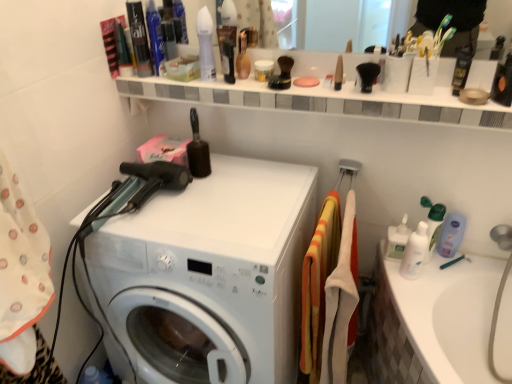
Describe the element at coordinates (322, 101) in the screenshot. Image resolution: width=512 pixels, height=384 pixels. I see `white glossy shelf at upper center` at that location.

Image resolution: width=512 pixels, height=384 pixels. Describe the element at coordinates (341, 300) in the screenshot. I see `white fabric at center, marked as the 1th material in a right-to-left arrangement` at that location.

This screenshot has width=512, height=384. Identify the location of shiny blue bottle at upper left, acting as the 7th toiletry starting from the bottom. (155, 38).

Where is `black matte hair gel at upper right, the 2th toiletry ordered from the bottom`? The width and height of the screenshot is (512, 384). black matte hair gel at upper right, the 2th toiletry ordered from the bottom is located at coordinates (462, 67).

What do you see at coordinates (263, 69) in the screenshot? The width and height of the screenshot is (512, 384). I see `white matte jar at upper center, placed as the 4th toiletry when sorted from bottom to top` at bounding box center [263, 69].

Locate an element on the screen. This screenshot has height=384, width=512. matte beige vase at upper center, which is the third toiletry in left-to-right order is located at coordinates (242, 57).

Which object is more forward, white plastic bottles at right, which is the 1th cleaning product in left-to-right order, or white matte jar at upper center, the 4th toiletry positioned from the left?

Positioned in front is white matte jar at upper center, the 4th toiletry positioned from the left.

Looking at this image, between white plastic bottles at right, positioned as the second cleaning product in right-to-left order, and white matte jar at upper center, placed as the 4th toiletry when sorted from bottom to top, which one has smaller width?

white plastic bottles at right, positioned as the second cleaning product in right-to-left order.

From the image's perspective, is white plastic bottles at right, which is the 1th cleaning product in left-to-right order, on white matte jar at upper center, which ranks as the 4th toiletry in right-to-left order?

No.

Is white plastic bottles at right, which is the 1th cleaning product in left-to-right order, in contact with white matte jar at upper center, which appears as the 4th toiletry when viewed from the top?

white plastic bottles at right, which is the 1th cleaning product in left-to-right order, is not next to white matte jar at upper center, which appears as the 4th toiletry when viewed from the top, and they're not touching.

Where is `the 4th toiletry in front of the shiny blue bottle at upper left, which is the 6th toiletry in right-to-left order, starting your count from the anchor`? the 4th toiletry in front of the shiny blue bottle at upper left, which is the 6th toiletry in right-to-left order, starting your count from the anchor is located at coordinates (462, 67).

Is black matte hair gel at upper right, the seventh toiletry positioned from the left, in front of or behind shiny blue bottle at upper left, the 2th toiletry positioned from the left, in the image?

Visually, black matte hair gel at upper right, the seventh toiletry positioned from the left, is located in front of shiny blue bottle at upper left, the 2th toiletry positioned from the left.

Is black matte hair gel at upper right, positioned as the sixth toiletry in top-to-bottom order, thinner than shiny blue bottle at upper left, marked as the first toiletry in a top-to-bottom arrangement?

Yes, black matte hair gel at upper right, positioned as the sixth toiletry in top-to-bottom order, is thinner than shiny blue bottle at upper left, marked as the first toiletry in a top-to-bottom arrangement.

From the image's perspective, is black matte hair gel at upper right, the seventh toiletry positioned from the left, located above shiny blue bottle at upper left, the 2th toiletry positioned from the left?

No.

Which of these two, orange/yellow striped towel at center, the first material in the left-to-right sequence, or white glossy lotion at right, which is the sixth toiletry from left to right, is smaller?

With smaller size is white glossy lotion at right, which is the sixth toiletry from left to right.

Can white glossy lotion at right, which ranks as the 7th toiletry in top-to-bottom order, be found inside orange/yellow striped towel at center, the second material viewed from the right?

No.

From a real-world perspective, is orange/yellow striped towel at center, the second material viewed from the right, below white glossy lotion at right, marked as the second toiletry in a right-to-left arrangement?

Yes, from a real-world perspective, orange/yellow striped towel at center, the second material viewed from the right, is under white glossy lotion at right, marked as the second toiletry in a right-to-left arrangement.

From the image's perspective, is orange/yellow striped towel at center, the first material in the left-to-right sequence, located above white glossy lotion at right, marked as the second toiletry in a right-to-left arrangement?

No, from the image's perspective, orange/yellow striped towel at center, the first material in the left-to-right sequence, is not on top of white glossy lotion at right, marked as the second toiletry in a right-to-left arrangement.

Is white fabric at center, which is the 2th material in left-to-right order, facing towards white glossy lotion at right, which ranks as the 7th toiletry in top-to-bottom order?

Yes.

Based on their sizes in the image, would you say white fabric at center, marked as the 1th material in a right-to-left arrangement, is bigger or smaller than white glossy lotion at right, which is the sixth toiletry from left to right?

In the image, white fabric at center, marked as the 1th material in a right-to-left arrangement, appears to be larger than white glossy lotion at right, which is the sixth toiletry from left to right.

Is white fabric at center, which is the 2th material in left-to-right order, completely or partially outside of white glossy lotion at right, which ranks as the 7th toiletry in top-to-bottom order?

Yes, white fabric at center, which is the 2th material in left-to-right order, is not within white glossy lotion at right, which ranks as the 7th toiletry in top-to-bottom order.

Is white fabric at center, which is the 2th material in left-to-right order, thinner than white glossy lotion at right, which ranks as the 7th toiletry in top-to-bottom order?

Incorrect, the width of white fabric at center, which is the 2th material in left-to-right order, is not less than that of white glossy lotion at right, which ranks as the 7th toiletry in top-to-bottom order.

Is shiny plastic hair spray at upper left, positioned as the seventh toiletry in right-to-left order, bigger or smaller than matte beige vase at upper center, which is the third toiletry in left-to-right order?

In the image, shiny plastic hair spray at upper left, positioned as the seventh toiletry in right-to-left order, appears to be larger than matte beige vase at upper center, which is the third toiletry in left-to-right order.

Does shiny plastic hair spray at upper left, the 1th toiletry viewed from the left, have a greater width compared to matte beige vase at upper center, the 3th toiletry in the top-to-bottom sequence?

Yes, shiny plastic hair spray at upper left, the 1th toiletry viewed from the left, is wider than matte beige vase at upper center, the 3th toiletry in the top-to-bottom sequence.

How many degrees apart are the facing directions of shiny plastic hair spray at upper left, the 1th toiletry viewed from the left, and matte beige vase at upper center, which is the 5th toiletry from bottom to top?

The facing directions of shiny plastic hair spray at upper left, the 1th toiletry viewed from the left, and matte beige vase at upper center, which is the 5th toiletry from bottom to top, are 8.19 degrees apart.

In order to click on shelve below the shiny blue bottle at upper left, marked as the first toiletry in a top-to-bottom arrangement (from a real-world perspective) in this screenshot , I will do `click(322, 101)`.

Is shiny blue bottle at upper left, marked as the first toiletry in a top-to-bottom arrangement, shorter than white glossy shelf at upper center?

Incorrect, the height of shiny blue bottle at upper left, marked as the first toiletry in a top-to-bottom arrangement, does not fall short of that of white glossy shelf at upper center.

Is shiny blue bottle at upper left, the 2th toiletry positioned from the left, not close to white glossy shelf at upper center?

No, shiny blue bottle at upper left, the 2th toiletry positioned from the left, is not far away from white glossy shelf at upper center.

From a real-world perspective, is white glossy lotion at right, marked as the second toiletry in a right-to-left arrangement, located beneath matte beige vase at upper center, which is the third toiletry in left-to-right order?

Correct, in the physical world, white glossy lotion at right, marked as the second toiletry in a right-to-left arrangement, is lower than matte beige vase at upper center, which is the third toiletry in left-to-right order.

What's the angular difference between white glossy lotion at right, which ranks as the first toiletry in bottom-to-top order, and matte beige vase at upper center, which is the third toiletry in left-to-right order,'s facing directions?

The facing directions of white glossy lotion at right, which ranks as the first toiletry in bottom-to-top order, and matte beige vase at upper center, which is the third toiletry in left-to-right order, are 3 degrees apart.

Is white glossy lotion at right, which is the sixth toiletry from left to right, oriented towards matte beige vase at upper center, the 5th toiletry when ordered from right to left?

No, white glossy lotion at right, which is the sixth toiletry from left to right, is not turned towards matte beige vase at upper center, the 5th toiletry when ordered from right to left.

Are white glossy lotion at right, marked as the second toiletry in a right-to-left arrangement, and matte beige vase at upper center, the 5th toiletry when ordered from right to left, making contact?

No, white glossy lotion at right, marked as the second toiletry in a right-to-left arrangement, is not next to matte beige vase at upper center, the 5th toiletry when ordered from right to left.

There is a white plastic bottles at right, positioned as the second cleaning product in right-to-left order. At what (x,y) coordinates should I click in order to perform the action: click on the 2nd toiletry above it (from a real-world perspective). Please return your answer as a coordinate pair (x, y). Looking at the image, I should click on (263, 69).

At what (x,y) coordinates should I click in order to perform the action: click on toiletry that is the 4th object located in front of the shiny blue bottle at upper left, the 2th toiletry positioned from the left. Please return your answer as a coordinate pair (x, y). The width and height of the screenshot is (512, 384). Looking at the image, I should click on (462, 67).

Looking at the image, which one is located further to black matte hair gel at upper right, positioned as the 1th toiletry in right-to-left order, white matte jar at upper center, placed as the 4th toiletry when sorted from bottom to top, or matte beige vase at upper center, which is the 5th toiletry from bottom to top?

Among the two, white matte jar at upper center, placed as the 4th toiletry when sorted from bottom to top, is located further to black matte hair gel at upper right, positioned as the 1th toiletry in right-to-left order.

Based on their spatial positions, is white plastic bottles at right, positioned as the second cleaning product in right-to-left order, or white glossy lotion at right, marked as the second toiletry in a right-to-left arrangement, closer to white matte jar at upper center, which appears as the 4th toiletry when viewed from the top?

Based on the image, white plastic bottles at right, positioned as the second cleaning product in right-to-left order, appears to be nearer to white matte jar at upper center, which appears as the 4th toiletry when viewed from the top.

Which object lies further to the anchor point white plastic washing machine at center, white glossy lotion at right, which ranks as the first toiletry in bottom-to-top order, or white fabric at center, which is the 2th material in left-to-right order?

white glossy lotion at right, which ranks as the first toiletry in bottom-to-top order.

Looking at the image, which one is located closer to white matte jar at upper center, which ranks as the 4th toiletry in right-to-left order, shiny plastic hair spray at upper left, acting as the 6th toiletry starting from the bottom, or clear plastic bottle at right, placed as the second cleaning product when sorted from left to right?

shiny plastic hair spray at upper left, acting as the 6th toiletry starting from the bottom, lies closer to white matte jar at upper center, which ranks as the 4th toiletry in right-to-left order, than the other object.

Estimate the real-world distances between objects in this image. Which object is further from white plastic washing machine at center, clear plastic bottle at right, placed as the second cleaning product when sorted from left to right, or white plastic bottles at right, positioned as the second cleaning product in right-to-left order?

clear plastic bottle at right, placed as the second cleaning product when sorted from left to right.

Estimate the real-world distances between objects in this image. Which object is closer to orange/yellow striped towel at center, the first material in the left-to-right sequence, shiny plastic hair spray at upper left, acting as the 6th toiletry starting from the bottom, or black matte hair gel at upper right, the seventh toiletry positioned from the left?

Based on the image, shiny plastic hair spray at upper left, acting as the 6th toiletry starting from the bottom, appears to be nearer to orange/yellow striped towel at center, the first material in the left-to-right sequence.

Considering their positions, is white glossy lotion at right, which is the sixth toiletry from left to right, positioned further to shiny plastic hair spray at upper left, acting as the 6th toiletry starting from the bottom, than white matte jar at upper center, the 4th toiletry positioned from the left?

white glossy lotion at right, which is the sixth toiletry from left to right, is positioned further to the anchor shiny plastic hair spray at upper left, acting as the 6th toiletry starting from the bottom.

Based on their spatial positions, is black matte hair gel at upper right, positioned as the 1th toiletry in right-to-left order, or white matte jar at upper center, which appears as the 4th toiletry when viewed from the top, closer to white plastic washing machine at center?

white matte jar at upper center, which appears as the 4th toiletry when viewed from the top, lies closer to white plastic washing machine at center than the other object.

Image resolution: width=512 pixels, height=384 pixels. I want to click on material between orange/yellow striped towel at center, the second material viewed from the right, and clear plastic bottle at right, which appears as the 1th cleaning product when viewed from the right, from left to right, so click(341, 300).

Identify the location of material between shiny blue bottle at upper left, the 2th toiletry positioned from the left, and white fabric at center, which is the 2th material in left-to-right order, in the vertical direction. The image size is (512, 384). [x=318, y=286].

The width and height of the screenshot is (512, 384). In order to click on shelve between matte plastic toothbrush at upper center, the 5th toiletry in the top-to-bottom sequence, and white fabric at center, which is the 2th material in left-to-right order, in the up-down direction in this screenshot , I will do `click(322, 101)`.

This screenshot has height=384, width=512. What are the coordinates of `toiletry between matte plastic toothbrush at upper center, which ranks as the 3th toiletry in right-to-left order, and white glossy lotion at right, which ranks as the 7th toiletry in top-to-bottom order, vertically` in the screenshot? It's located at pos(462,67).